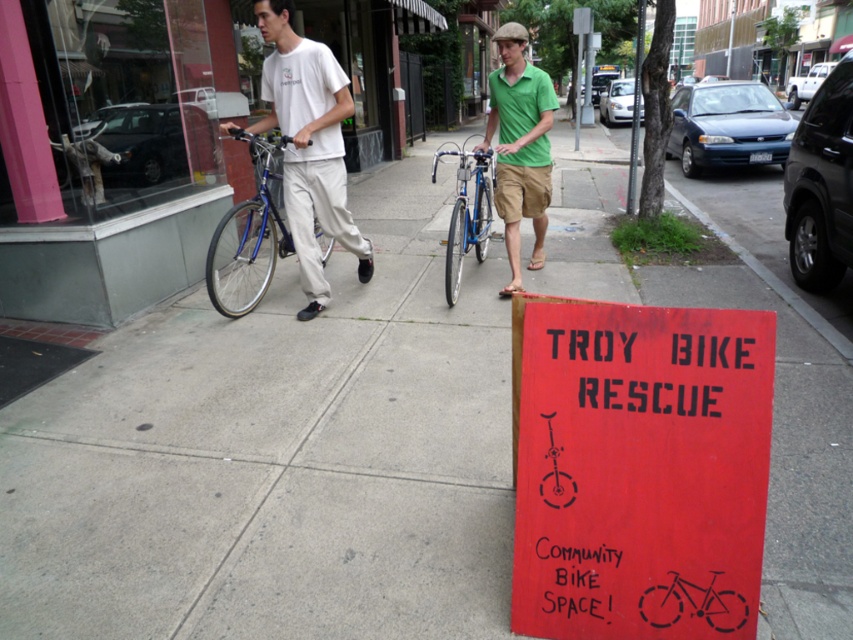
You are standing at the center of the sidewalk and want to find the red wood sign at center. According to the scene description, where should you look relative to your position?

The red wood sign at center is located at the center of the scene, so you should look straight ahead towards the center to find it.